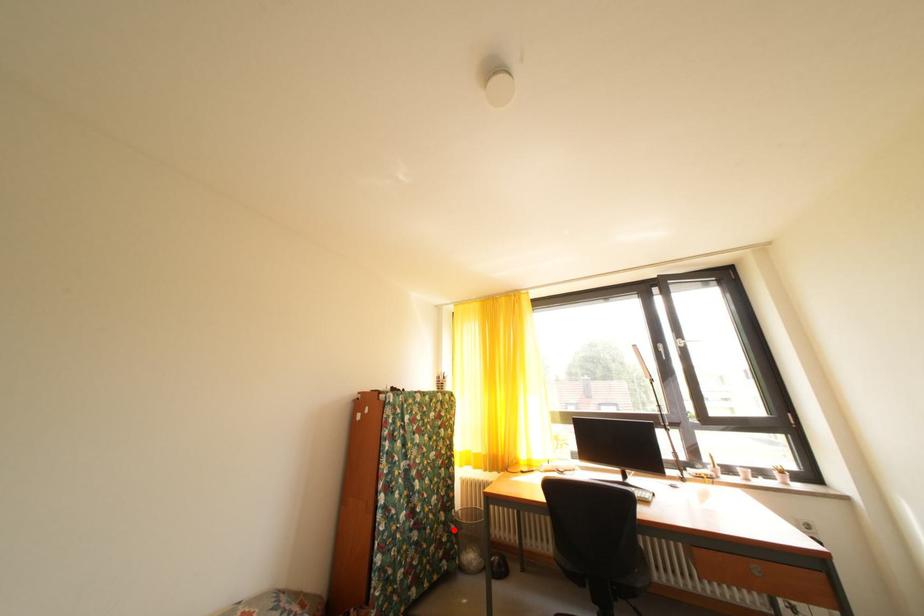
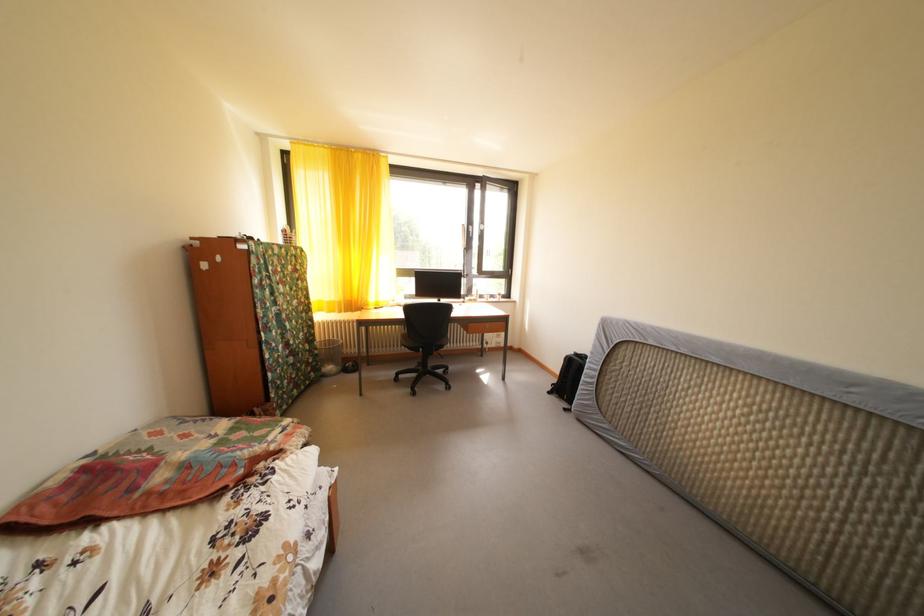
In the second image, find the point that corresponds to the highlighted location in the first image.

(320, 357)